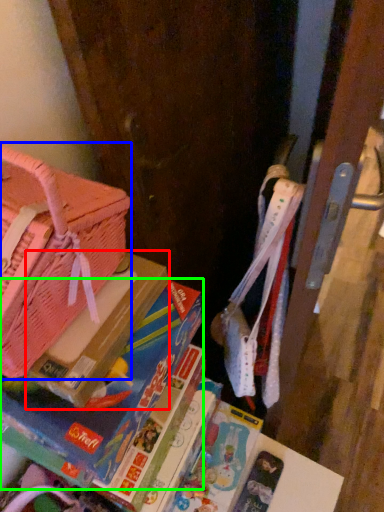
Question: Considering the real-world distances, which object is closest to paperback book (highlighted by a red box)? handbag (highlighted by a blue box) or book (highlighted by a green box).

Choices:
 (A) handbag
 (B) book

Answer: (B)